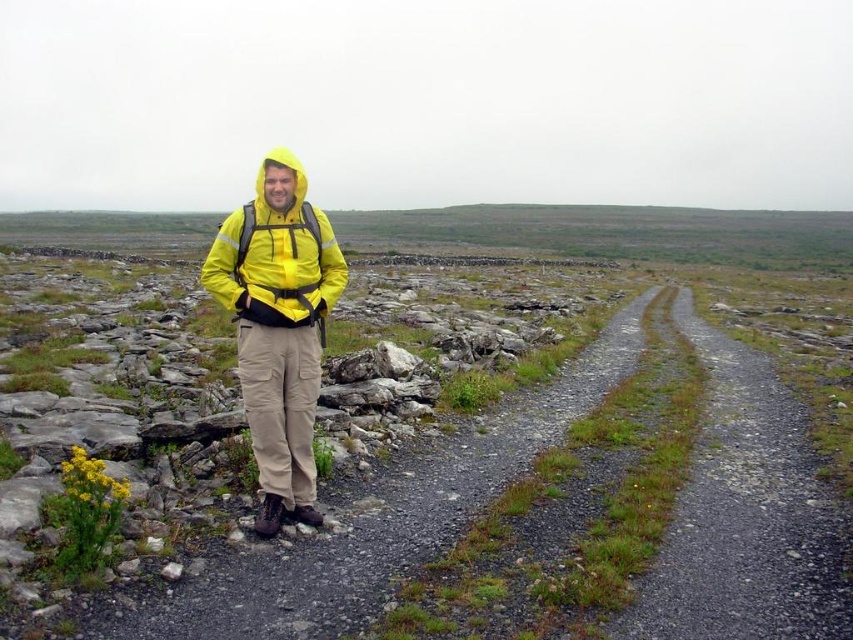
Question: Which of the following is the farthest from the observer?

Choices:
 (A) (236, 305)
 (B) (305, 307)

Answer: (B)

Question: Which of the following is the farthest from the observer?

Choices:
 (A) [306, 310]
 (B) [305, 486]

Answer: (A)

Question: Is yellow matte jacket at center below matte yellow jacket at center?

Choices:
 (A) yes
 (B) no

Answer: (A)

Question: Is yellow matte jacket at center thinner than matte yellow jacket at center?

Choices:
 (A) no
 (B) yes

Answer: (A)

Question: Does yellow matte jacket at center have a greater width compared to matte yellow jacket at center?

Choices:
 (A) yes
 (B) no

Answer: (A)

Question: Which point appears closest to the camera in this image?

Choices:
 (A) (294, 272)
 (B) (251, 410)

Answer: (B)